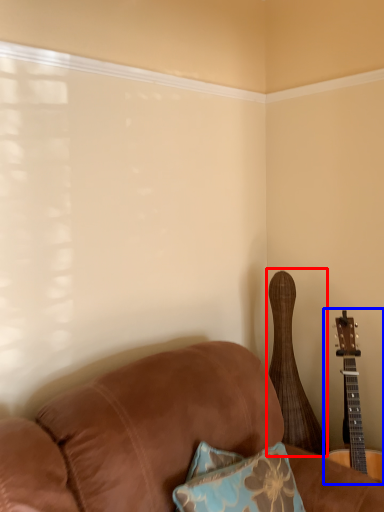
Question: Among these objects, which one is farthest to the camera, guitar (highlighted by a red box) or guitar (highlighted by a blue box)?

Choices:
 (A) guitar
 (B) guitar

Answer: (A)